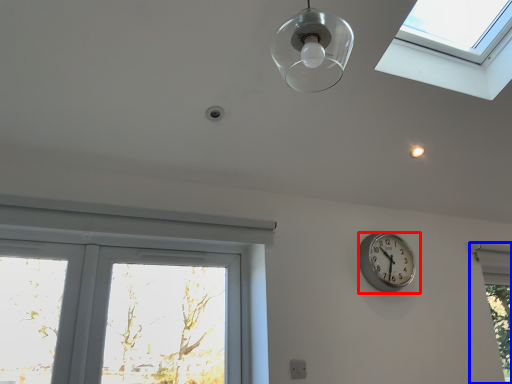
Question: Which of the following is the closest to the observer, wall clock (highlighted by a red box) or window (highlighted by a blue box)?

Choices:
 (A) wall clock
 (B) window

Answer: (A)